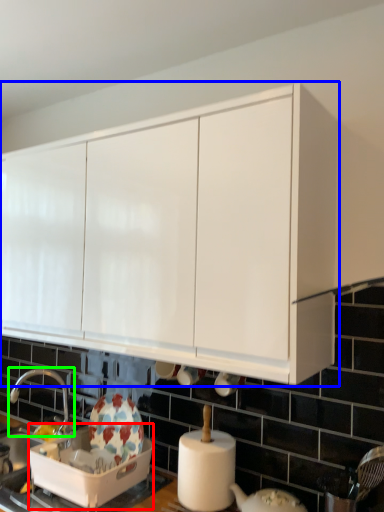
Question: Based on their relative distances, which object is farther from appliance (highlighted by a red box)? Choose from cabinetry (highlighted by a blue box) and tap (highlighted by a green box).

Choices:
 (A) cabinetry
 (B) tap

Answer: (A)